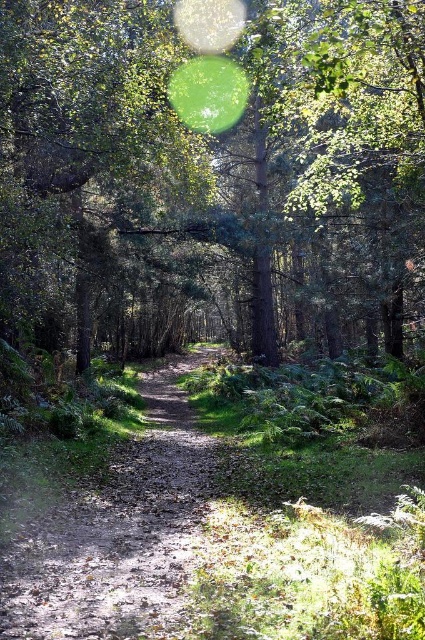
Question: Which of the following is the farthest from the observer?

Choices:
 (A) (93, 548)
 (B) (127, 300)

Answer: (B)

Question: Which of the following is the farthest from the observer?

Choices:
 (A) (113, 589)
 (B) (209, 260)

Answer: (B)

Question: Does green leafy tree at center come behind dirt path at center?

Choices:
 (A) no
 (B) yes

Answer: (B)

Question: Where is green leafy tree at center located in relation to dirt path at center in the image?

Choices:
 (A) right
 (B) left

Answer: (B)

Question: Is green leafy tree at center to the right of dirt path at center from the viewer's perspective?

Choices:
 (A) no
 (B) yes

Answer: (A)